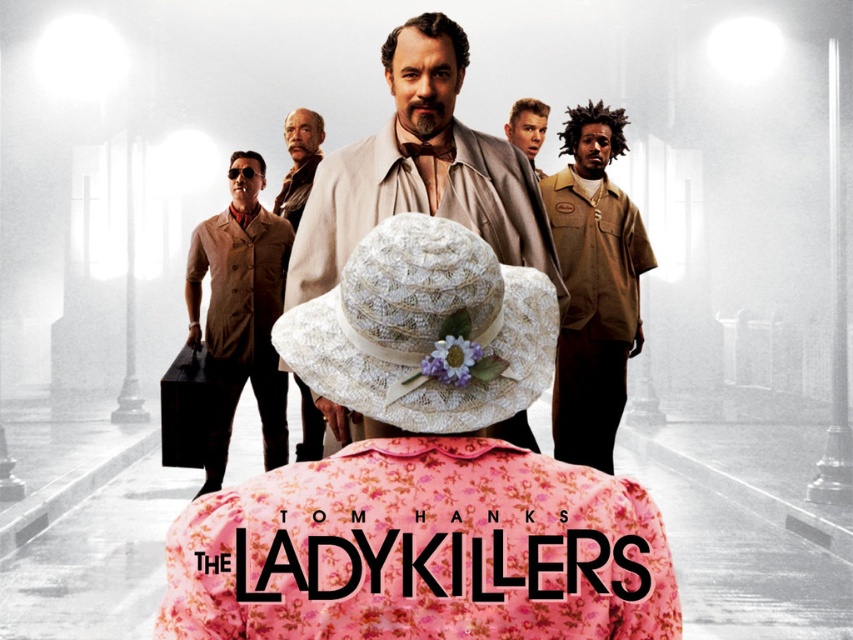
Between floral fabric hat at center and smooth brown suit at center, which one has less height?

floral fabric hat at center

Consider the image. Does floral fabric hat at center appear under smooth brown suit at center?

Correct, floral fabric hat at center is located below smooth brown suit at center.

Measure the distance between point [517,324] and camera.

Point [517,324] is 2.07 meters from camera.

The image size is (853, 640). I want to click on floral fabric hat at center, so coord(422,476).

Who is shorter, beige wool coat at center or smooth brown suit at center?

smooth brown suit at center

Can you confirm if beige wool coat at center is positioned to the right of smooth brown suit at center?

Correct, you'll find beige wool coat at center to the right of smooth brown suit at center.

Which is in front, point (358, 160) or point (305, 118)?

Point (358, 160) is in front.

I want to click on beige wool coat at center, so click(421, 170).

Is floral fabric hat at center positioned in front of brown leather vest at left?

Yes, it is in front of brown leather vest at left.

Who is more distant from viewer, (512, 317) or (228, 253)?

The point (228, 253) is behind.

Who is more distant from viewer, (456, 278) or (225, 266)?

→ The point (225, 266) is behind.

In order to click on floral fabric hat at center in this screenshot , I will do [x=422, y=476].